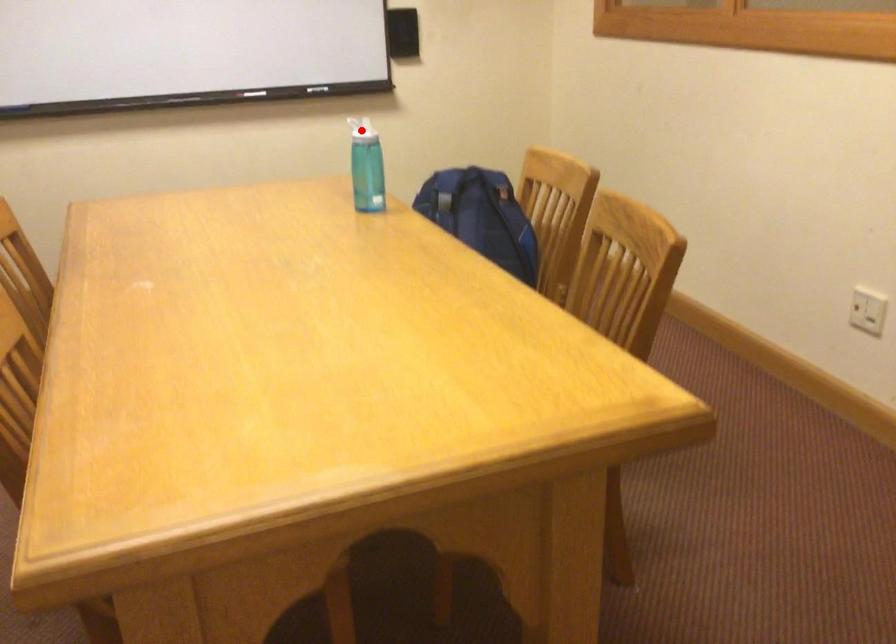
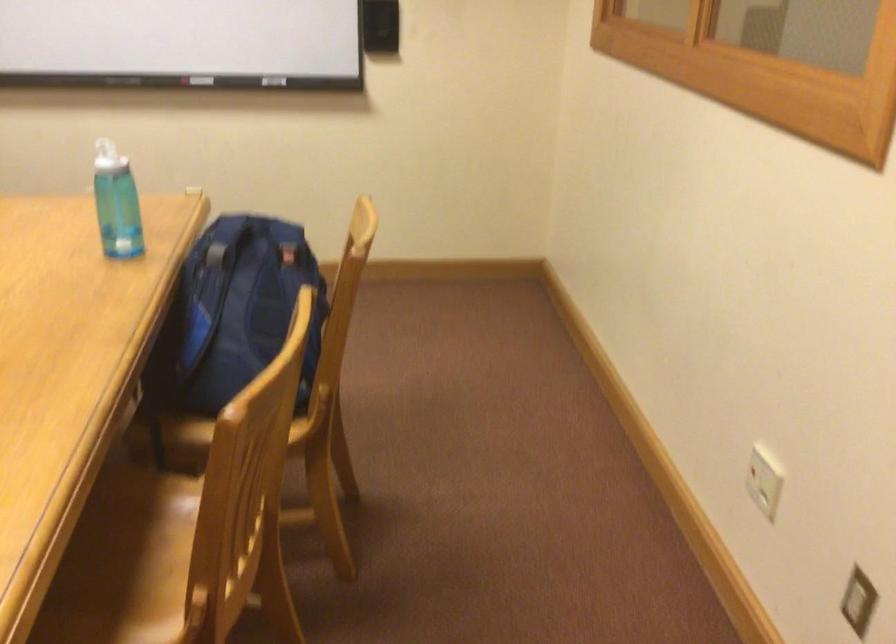
Question: I am providing you with two images of the same scene from different viewpoints. A red point is marked on the first image. Can you still see the location of the red point in image 2?

Choices:
 (A) Yes
 (B) No

Answer: (B)